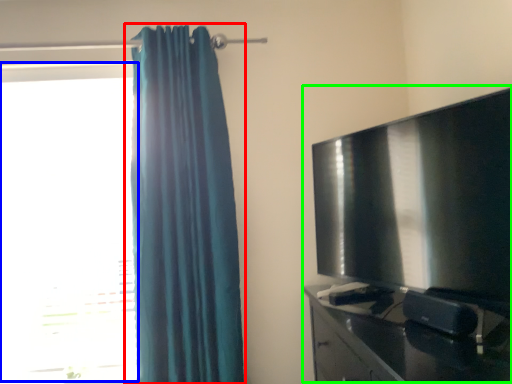
Question: Which object is the closest to the curtain (highlighted by a red box)? Choose among these: window (highlighted by a blue box) or entertainment center (highlighted by a green box).

Choices:
 (A) window
 (B) entertainment center

Answer: (A)